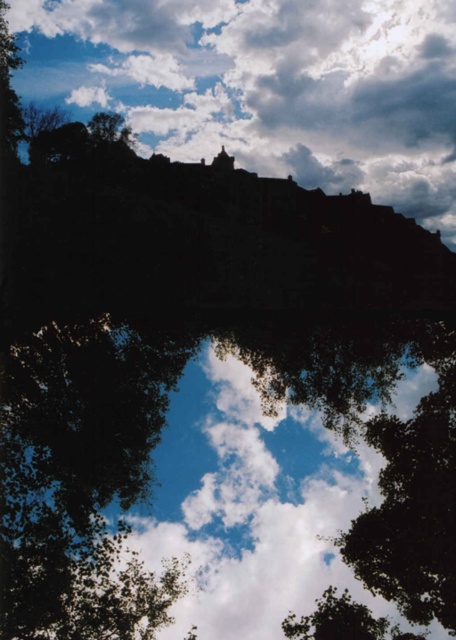
Who is more distant from viewer, [423,164] or [117,134]?

The point [423,164] is more distant.

Can you confirm if white fluffy cloud at upper center is smaller than green leafy tree at upper center?

Incorrect, white fluffy cloud at upper center is not smaller in size than green leafy tree at upper center.

Locate an element on the screen. white fluffy cloud at upper center is located at coordinates (265, 84).